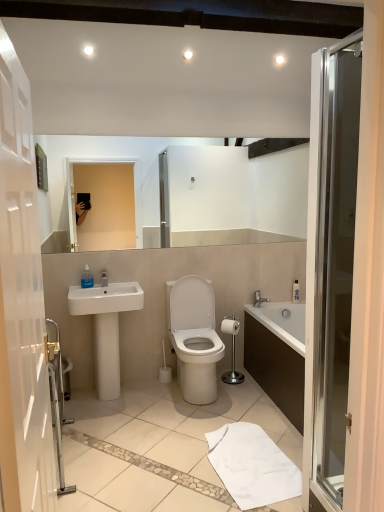
Question: Is translucent plastic soap dispenser at sink, which appears as the first toiletry when viewed from the front, at the left side of white glossy toilet at center?

Choices:
 (A) no
 (B) yes

Answer: (B)

Question: Considering the relative sizes of translucent plastic soap dispenser at sink, which appears as the first toiletry when viewed from the front, and white glossy toilet at center in the image provided, is translucent plastic soap dispenser at sink, which appears as the first toiletry when viewed from the front, shorter than white glossy toilet at center?

Choices:
 (A) yes
 (B) no

Answer: (A)

Question: Is translucent plastic soap dispenser at sink, which is counted as the first toiletry, starting from the top, taller than white glossy toilet at center?

Choices:
 (A) no
 (B) yes

Answer: (A)

Question: Is translucent plastic soap dispenser at sink, which is counted as the first toiletry, starting from the top, aimed at white glossy toilet at center?

Choices:
 (A) yes
 (B) no

Answer: (B)

Question: Can you confirm if translucent plastic soap dispenser at sink, which is the 1th toiletry from left to right, is wider than white glossy toilet at center?

Choices:
 (A) yes
 (B) no

Answer: (B)

Question: From the image's perspective, is translucent plastic soap dispenser at sink, which is counted as the first toiletry, starting from the top, located above white glossy toilet at center?

Choices:
 (A) no
 (B) yes

Answer: (B)

Question: From the image's perspective, is white matte toilet paper at center below translucent plastic soap dispenser at sink, which is the 1th toiletry from left to right?

Choices:
 (A) yes
 (B) no

Answer: (A)

Question: Is white matte toilet paper at center completely or partially outside of translucent plastic soap dispenser at sink, which appears as the first toiletry when viewed from the front?

Choices:
 (A) no
 (B) yes

Answer: (B)

Question: Are white matte toilet paper at center and translucent plastic soap dispenser at sink, which is counted as the first toiletry, starting from the top, far apart?

Choices:
 (A) no
 (B) yes

Answer: (B)

Question: From the image's perspective, is white matte toilet paper at center on top of translucent plastic soap dispenser at sink, which is counted as the first toiletry, starting from the top?

Choices:
 (A) no
 (B) yes

Answer: (A)

Question: Can you confirm if white matte toilet paper at center is smaller than translucent plastic soap dispenser at sink, the 2th toiletry in the back-to-front sequence?

Choices:
 (A) no
 (B) yes

Answer: (A)

Question: Can you confirm if white matte toilet paper at center is shorter than translucent plastic soap dispenser at sink, which appears as the first toiletry when viewed from the front?

Choices:
 (A) no
 (B) yes

Answer: (B)

Question: From a real-world perspective, is transparent glass door at right physically below translucent plastic soap dispenser at sink, which is counted as the first toiletry, starting from the top?

Choices:
 (A) no
 (B) yes

Answer: (A)